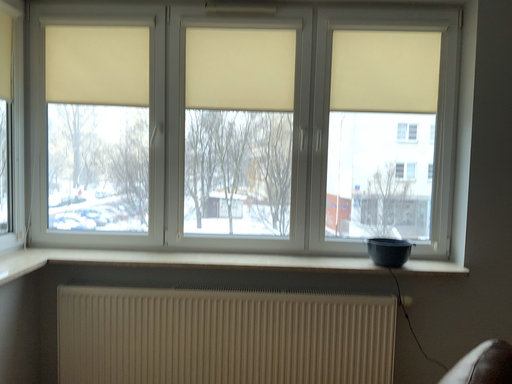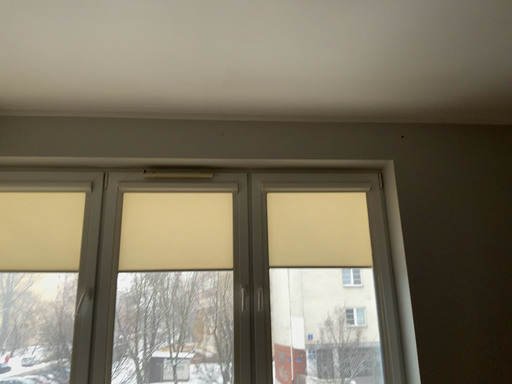
Question: How did the camera likely rotate when shooting the video?

Choices:
 (A) rotated right
 (B) rotated left

Answer: (A)